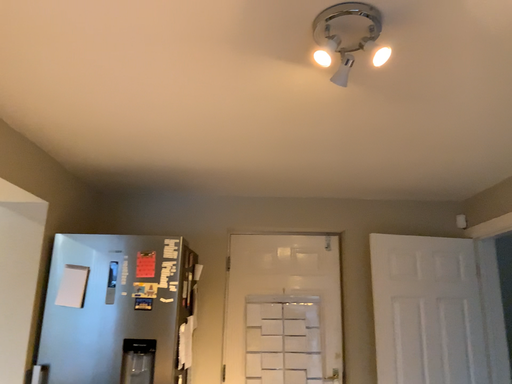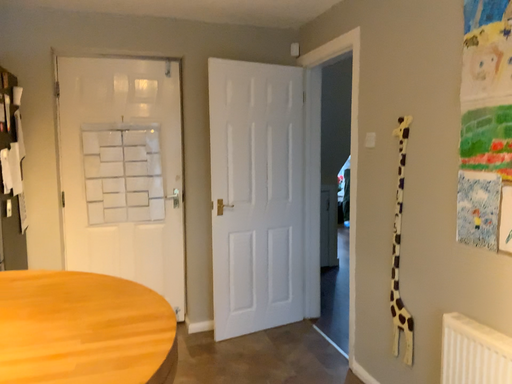
Question: How did the camera likely rotate when shooting the video?

Choices:
 (A) rotated left
 (B) rotated right

Answer: (B)